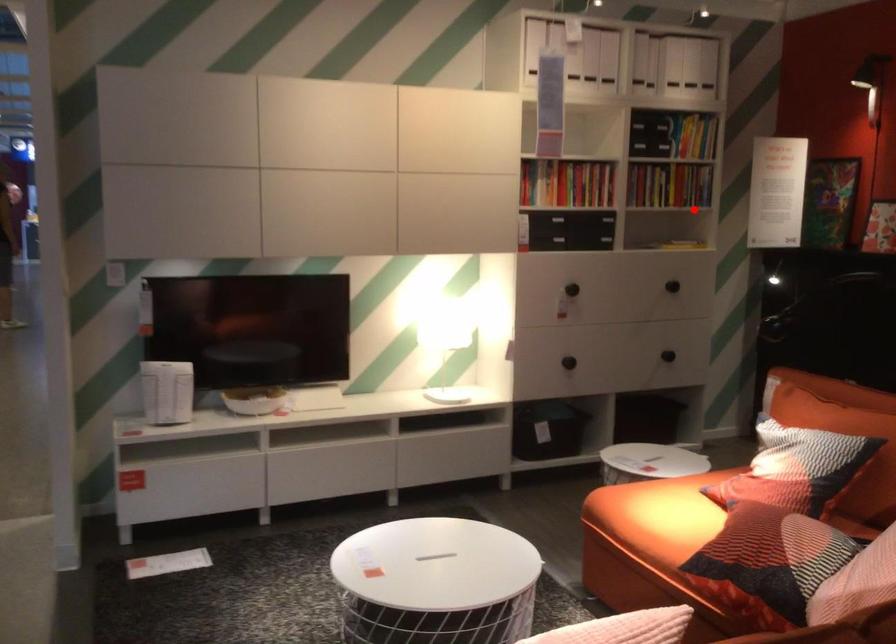
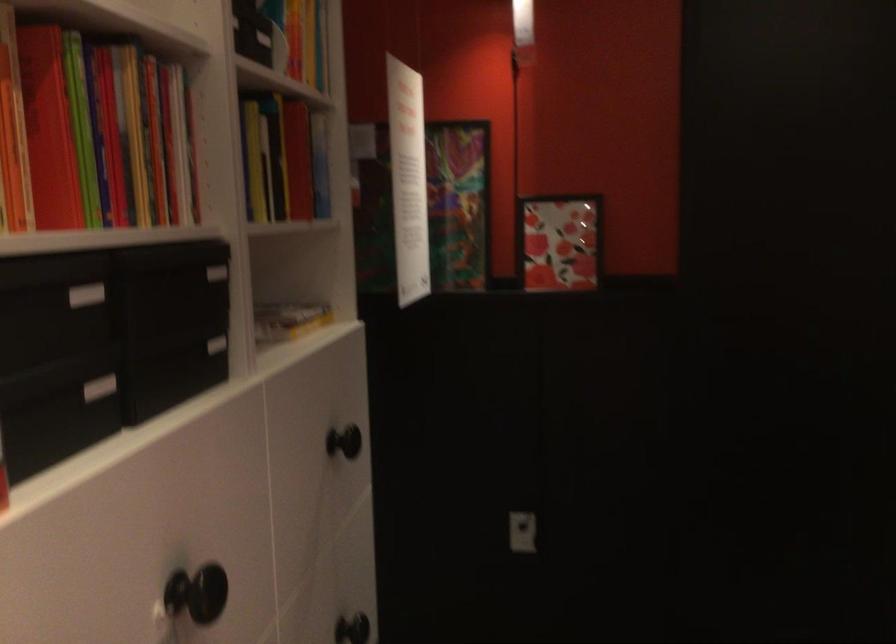
Question: I am providing you with two images of the same scene from different viewpoints. A red point is marked on the first image. Is the red point's position out of view in image 2?

Choices:
 (A) Yes
 (B) No

Answer: (B)